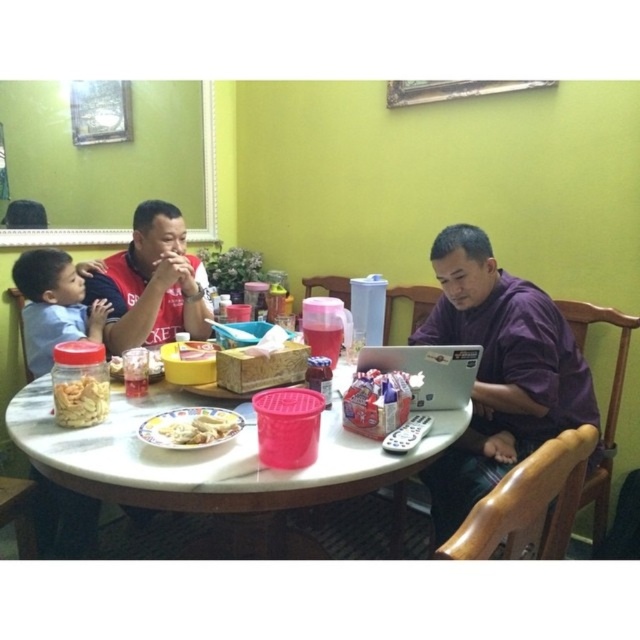
You are sitting at the dining table and want to grab the yellow matte plastic container at center to get a snack. However, the smooth blue shirt at left is blocking your path. Can you reach the container without moving the shirt?

The yellow matte plastic container at center is behind the smooth blue shirt at left, so you will need to move the shirt to access it.